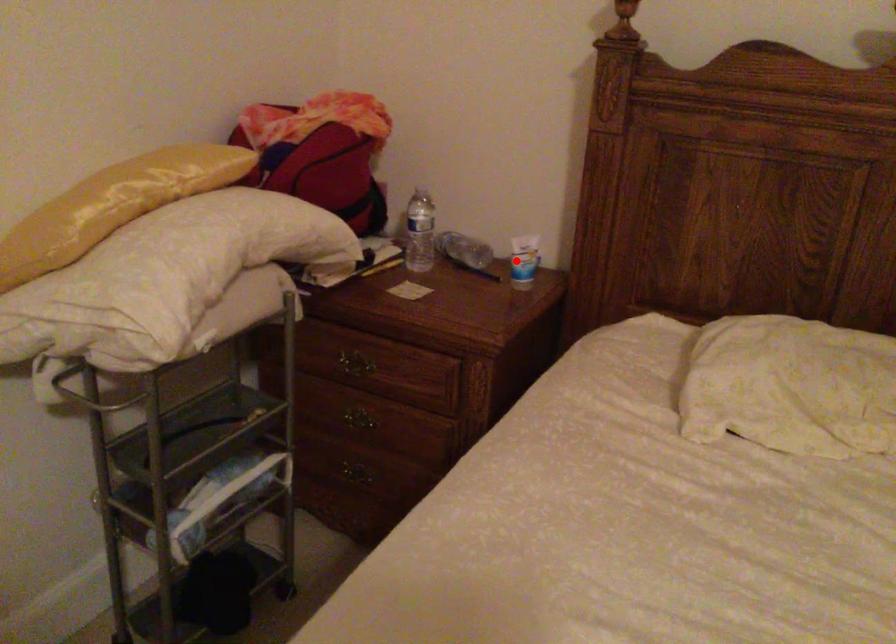
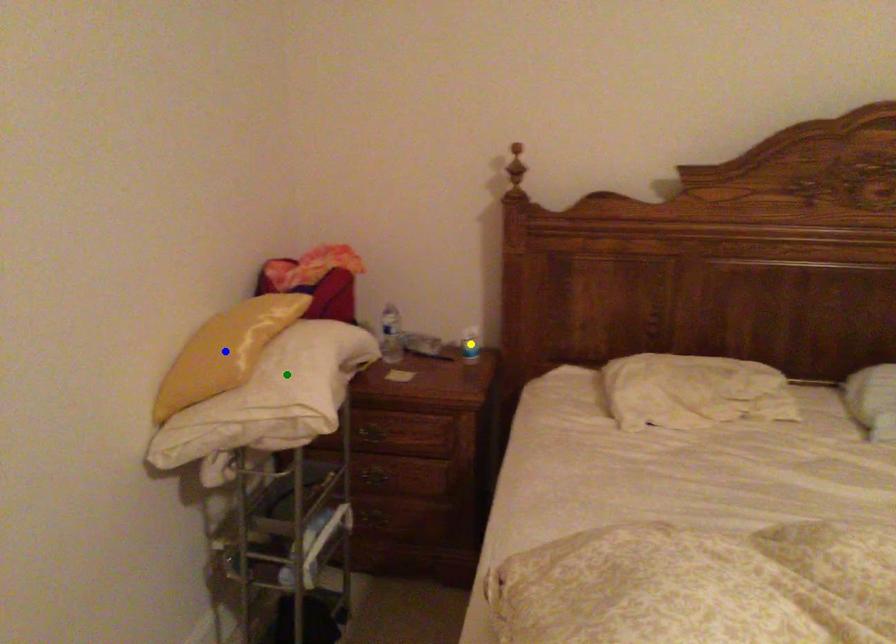
Question: I am providing you with two images of the same scene from different viewpoints. A red point is marked on the first image. You are given multiple points on the second image. In image 2, which mark is for the same physical point as the one in image 1?

Choices:
 (A) yellow point
 (B) green point
 (C) blue point

Answer: (A)